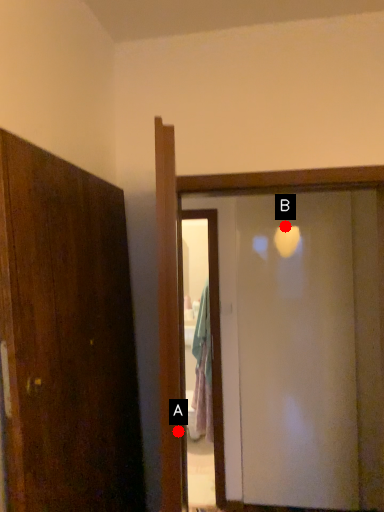
Question: Two points are circled on the image, labeled by A and B beside each circle. Which point is farther from the camera taking this photo?

Choices:
 (A) A is further
 (B) B is further

Answer: (B)